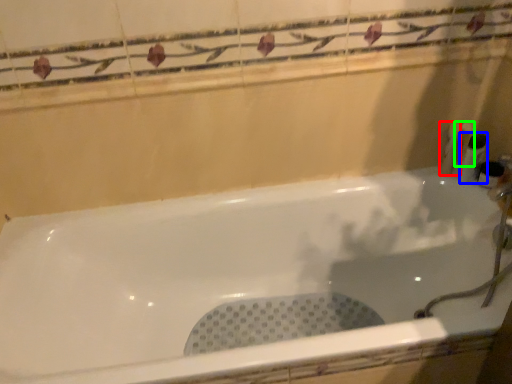
Question: Based on their relative distances, which object is farther from toiletry (highlighted by a red box)? Choose from toiletry (highlighted by a blue box) and toiletry (highlighted by a green box).

Choices:
 (A) toiletry
 (B) toiletry

Answer: (A)